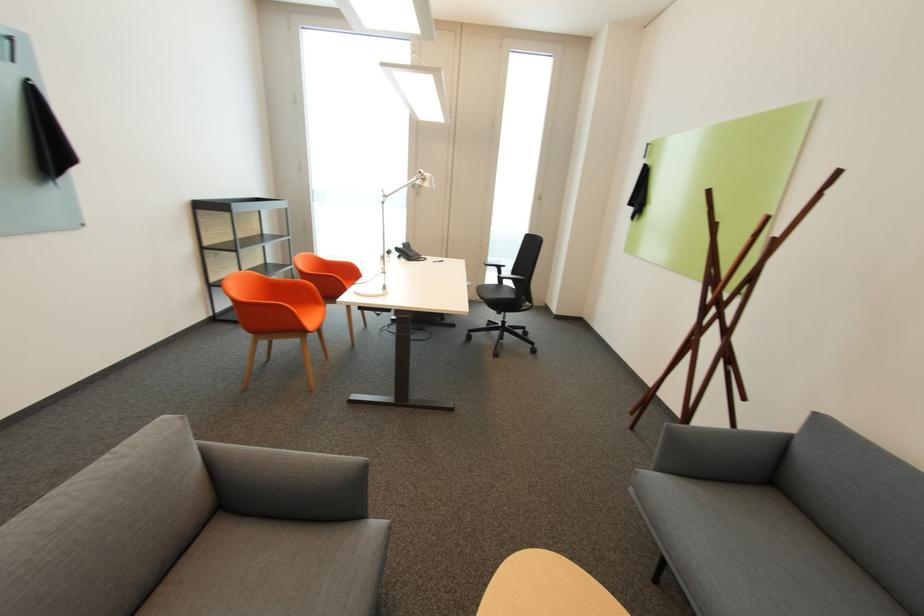
Find where to hang the wooden coat rack stick. Please return your answer as a coordinate pair (x, y).

(723, 312)